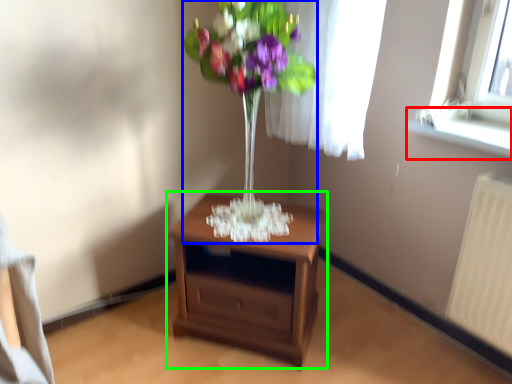
Question: Based on their relative distances, which object is farther from window sill (highlighted by a red box)? Choose from floral arrangement (highlighted by a blue box) and nightstand (highlighted by a green box).

Choices:
 (A) floral arrangement
 (B) nightstand

Answer: (B)